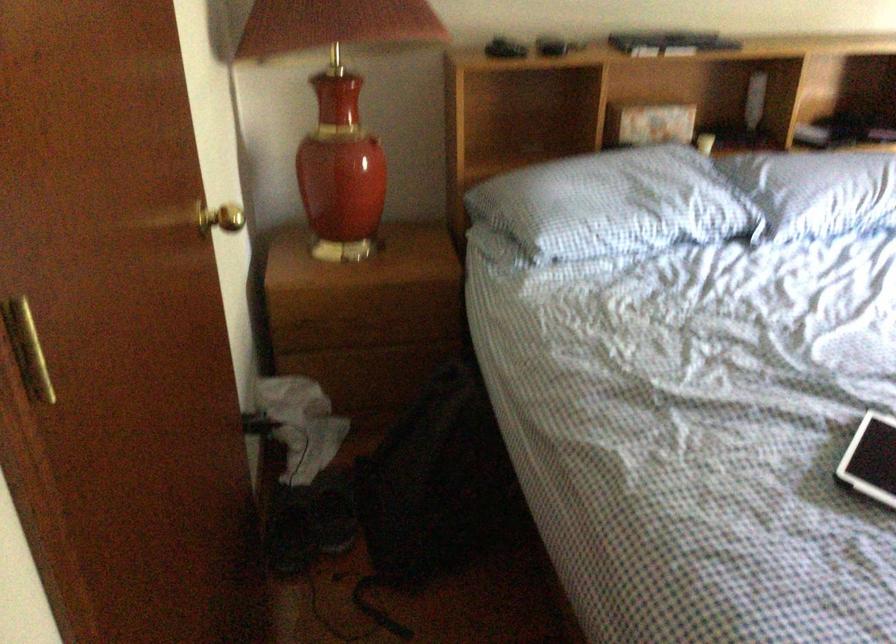
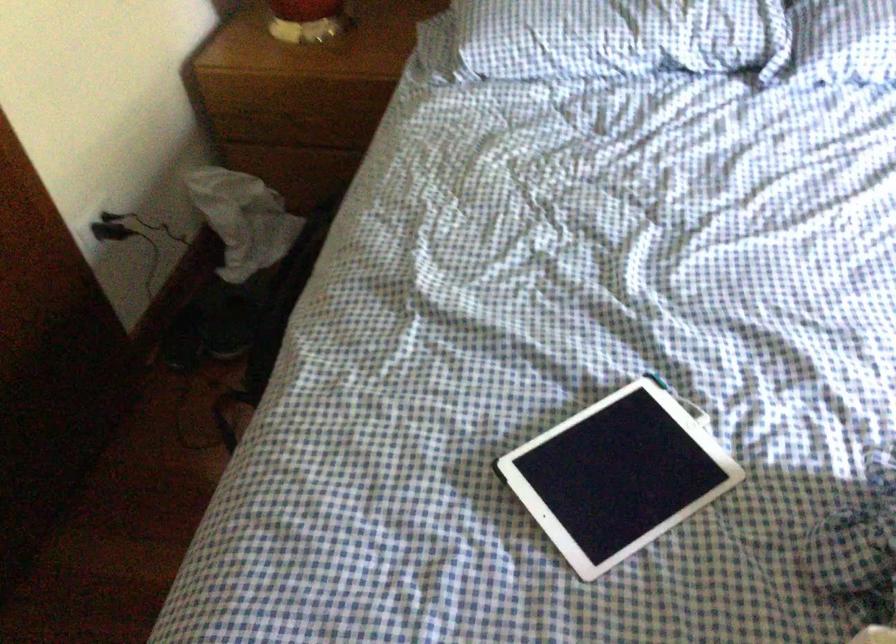
Which direction would the cameraman need to move to produce the second image?

The cameraman walked toward right, forward.